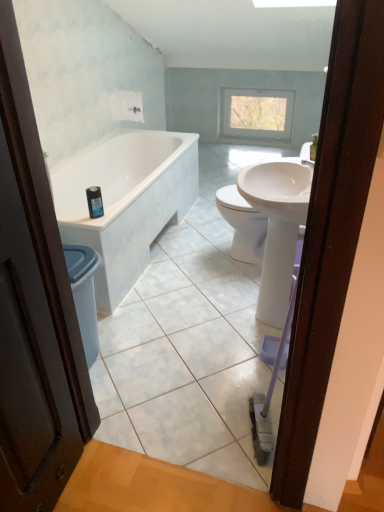
What do you see at coordinates (277, 227) in the screenshot? The width and height of the screenshot is (384, 512). I see `white glossy sink at center` at bounding box center [277, 227].

This screenshot has width=384, height=512. Identify the location of clear glass window at upper center. (256, 113).

Describe the element at coordinates (94, 201) in the screenshot. The width and height of the screenshot is (384, 512). I see `blue glossy bottle at upper left` at that location.

The height and width of the screenshot is (512, 384). I want to click on white glossy sink at center, so click(x=277, y=227).

Which of these two, clear glass window at upper center or blue glossy bottle at upper left, is smaller?

blue glossy bottle at upper left.

In the image, is clear glass window at upper center on the left side or the right side of blue glossy bottle at upper left?

clear glass window at upper center is to the right of blue glossy bottle at upper left.

Would you say clear glass window at upper center is a long distance from blue glossy bottle at upper left?

Indeed, clear glass window at upper center is not near blue glossy bottle at upper left.

Is clear glass window at upper center outside of white glossy sink at center?

Absolutely, clear glass window at upper center is external to white glossy sink at center.

Is clear glass window at upper center shorter than white glossy sink at center?

Correct, clear glass window at upper center is not as tall as white glossy sink at center.

Is clear glass window at upper center bigger or smaller than white glossy sink at center?

Clearly, clear glass window at upper center is smaller in size than white glossy sink at center.

From a real-world perspective, is clear glass window at upper center located higher than white glossy sink at center?

No.

Consider the image. Does white glossy bathtub at left appear on the right side of clear glass window at upper center?

No.

From a real-world perspective, is white glossy bathtub at left on clear glass window at upper center?

Actually, white glossy bathtub at left is physically below clear glass window at upper center in the real world.

Is white glossy bathtub at left bigger or smaller than clear glass window at upper center?

white glossy bathtub at left is bigger than clear glass window at upper center.

Does point (174, 151) lie in front of point (283, 110)?

Yes, point (174, 151) is in front of point (283, 110).

The image size is (384, 512). I want to click on bathtub located underneath the white glossy sink at center (from a real-world perspective), so click(126, 201).

Considering the relative sizes of white glossy bathtub at left and white glossy sink at center in the image provided, is white glossy bathtub at left wider than white glossy sink at center?

Correct, the width of white glossy bathtub at left exceeds that of white glossy sink at center.

From a real-world perspective, is white glossy bathtub at left located higher than white glossy sink at center?

No, from a real-world perspective, white glossy bathtub at left is not above white glossy sink at center.

Could you tell me if white glossy bathtub at left is facing white glossy sink at center?

Yes, white glossy bathtub at left is oriented towards white glossy sink at center.

Which is nearer, [133,166] or [100,193]?

Point [133,166] is positioned farther from the camera compared to point [100,193].

From a real-world perspective, is white glossy bathtub at left under blue glossy bottle at upper left?

Yes, from a real-world perspective, white glossy bathtub at left is beneath blue glossy bottle at upper left.

From the picture: What's the angular difference between white glossy bathtub at left and blue glossy bottle at upper left's facing directions?

0.0042 degrees separate the facing orientations of white glossy bathtub at left and blue glossy bottle at upper left.

Could you tell me if white glossy bathtub at left is facing blue glossy bottle at upper left?

No.

Is white glossy sink at center next to blue glossy bottle at upper left?

white glossy sink at center and blue glossy bottle at upper left are not in contact.

Is white glossy sink at center aimed at blue glossy bottle at upper left?

Yes, white glossy sink at center is oriented towards blue glossy bottle at upper left.

Which is closer, (277, 233) or (97, 215)?

Positioned in front is point (277, 233).

Considering the relative positions of white glossy sink at center and blue glossy bottle at upper left in the image provided, is white glossy sink at center to the right of blue glossy bottle at upper left from the viewer's perspective?

Indeed, white glossy sink at center is positioned on the right side of blue glossy bottle at upper left.

Between white glossy sink at center and clear glass window at upper center, which one has more height?

white glossy sink at center.

From the image's perspective, which is below, white glossy sink at center or clear glass window at upper center?

white glossy sink at center, from the image's perspective.

How many degrees apart are the facing directions of white glossy sink at center and clear glass window at upper center?

They differ by 91.2 degrees in their facing directions.

Based on the photo, can we say white glossy sink at center lies outside clear glass window at upper center?

white glossy sink at center is positioned outside clear glass window at upper center.

At what (x,y) coordinates should I click in order to perform the action: click on window above the blue glossy bottle at upper left (from the image's perspective). Please return your answer as a coordinate pair (x, y). This screenshot has width=384, height=512. Looking at the image, I should click on (256, 113).

Find the location of a particular element. The height and width of the screenshot is (512, 384). sink that is above the clear glass window at upper center (from a real-world perspective) is located at coordinates (277, 227).

When comparing their distances from clear glass window at upper center, does white glossy sink at center or white glossy bathtub at left seem further?

Among the two, white glossy sink at center is located further to clear glass window at upper center.

Considering their positions, is blue glossy bottle at upper left positioned further to white glossy sink at center than clear glass window at upper center?

clear glass window at upper center lies further to white glossy sink at center than the other object.

Which object lies further to the anchor point blue glossy bottle at upper left, white glossy bathtub at left or white glossy sink at center?

The object further to blue glossy bottle at upper left is white glossy sink at center.

When comparing their distances from clear glass window at upper center, does blue glossy bottle at upper left or white glossy bathtub at left seem further?

The object further to clear glass window at upper center is blue glossy bottle at upper left.

Which object lies nearer to the anchor point white glossy sink at center, white glossy bathtub at left or blue glossy bottle at upper left?

blue glossy bottle at upper left lies closer to white glossy sink at center than the other object.

Based on their spatial positions, is clear glass window at upper center or white glossy bathtub at left further from blue glossy bottle at upper left?

The object further to blue glossy bottle at upper left is clear glass window at upper center.

Based on their spatial positions, is white glossy sink at center or blue glossy bottle at upper left further from white glossy bathtub at left?

white glossy sink at center.

From the image, which object appears to be nearer to blue glossy bottle at upper left, white glossy sink at center or clear glass window at upper center?

The object closer to blue glossy bottle at upper left is white glossy sink at center.

The image size is (384, 512). What are the coordinates of `toiletry positioned between white glossy bathtub at left and clear glass window at upper center from near to far` in the screenshot? It's located at (94, 201).

Locate an element on the screen. This screenshot has height=512, width=384. toiletry situated between white glossy bathtub at left and white glossy sink at center from left to right is located at coordinates (94, 201).

Locate an element on the screen. This screenshot has width=384, height=512. toiletry positioned between white glossy sink at center and clear glass window at upper center from near to far is located at coordinates (94, 201).

At what (x,y) coordinates should I click in order to perform the action: click on bathtub between white glossy sink at center and clear glass window at upper center in the front-back direction. Please return your answer as a coordinate pair (x, y). The height and width of the screenshot is (512, 384). Looking at the image, I should click on (126, 201).